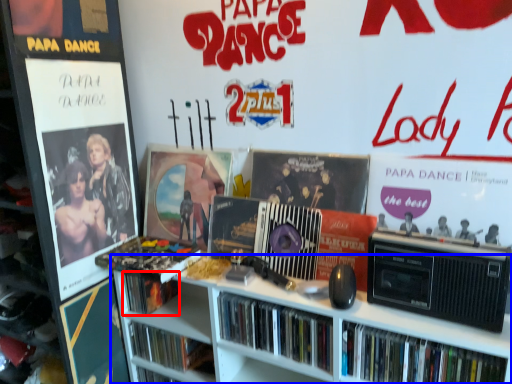
Question: Which point is further to the camera, book (highlighted by a red box) or bookcase (highlighted by a blue box)?

Choices:
 (A) book
 (B) bookcase

Answer: (A)